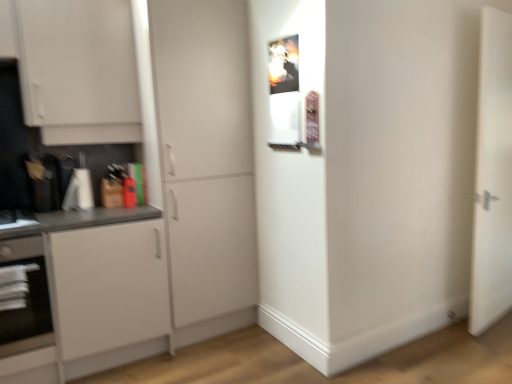
Question: Can you confirm if white matte door at right, which appears as the 2th door when viewed from the left, is smaller than white matte cabinet at center, arranged as the 2th door when viewed from the right?

Choices:
 (A) no
 (B) yes

Answer: (B)

Question: Is white matte door at right, which appears as the 2th door when viewed from the left, positioned with its back to white matte cabinet at center, marked as the 1th door in a left-to-right arrangement?

Choices:
 (A) yes
 (B) no

Answer: (B)

Question: Considering the relative sizes of white matte door at right, arranged as the first door when viewed from the right, and white matte cabinet at center, arranged as the 2th door when viewed from the right, in the image provided, is white matte door at right, arranged as the first door when viewed from the right, thinner than white matte cabinet at center, arranged as the 2th door when viewed from the right,?

Choices:
 (A) no
 (B) yes

Answer: (B)

Question: Considering the relative positions of white matte door at right, which appears as the 2th door when viewed from the left, and white matte cabinet at center, marked as the 1th door in a left-to-right arrangement, in the image provided, is white matte door at right, which appears as the 2th door when viewed from the left, in front of white matte cabinet at center, marked as the 1th door in a left-to-right arrangement,?

Choices:
 (A) no
 (B) yes

Answer: (A)

Question: From a real-world perspective, is white matte door at right, arranged as the first door when viewed from the right, under white matte cabinet at center, arranged as the 2th door when viewed from the right?

Choices:
 (A) no
 (B) yes

Answer: (B)

Question: Are white matte door at right, which appears as the 2th door when viewed from the left, and white matte cabinet at center, marked as the 1th door in a left-to-right arrangement, located far from each other?

Choices:
 (A) yes
 (B) no

Answer: (A)

Question: Is the position of white matte cabinet at center, arranged as the 2th door when viewed from the right, less distant than that of white matte door at right, which appears as the 2th door when viewed from the left?

Choices:
 (A) no
 (B) yes

Answer: (B)

Question: Does white matte cabinet at center, marked as the 1th door in a left-to-right arrangement, have a lesser height compared to white matte door at right, which appears as the 2th door when viewed from the left?

Choices:
 (A) yes
 (B) no

Answer: (B)

Question: From a real-world perspective, is white matte cabinet at center, marked as the 1th door in a left-to-right arrangement, on white matte door at right, which appears as the 2th door when viewed from the left?

Choices:
 (A) yes
 (B) no

Answer: (A)

Question: Is white matte cabinet at center, arranged as the 2th door when viewed from the right, looking in the opposite direction of white matte door at right, which appears as the 2th door when viewed from the left?

Choices:
 (A) yes
 (B) no

Answer: (B)

Question: From a real-world perspective, does white matte cabinet at center, arranged as the 2th door when viewed from the right, sit lower than white matte door at right, which appears as the 2th door when viewed from the left?

Choices:
 (A) no
 (B) yes

Answer: (A)

Question: Is white matte cabinet at center, arranged as the 2th door when viewed from the right, touching white matte door at right, arranged as the first door when viewed from the right?

Choices:
 (A) yes
 (B) no

Answer: (B)

Question: Considering the relative positions of black glass oven at lower left and white matte cabinet at center, marked as the 1th door in a left-to-right arrangement, in the image provided, is black glass oven at lower left to the left of white matte cabinet at center, marked as the 1th door in a left-to-right arrangement, from the viewer's perspective?

Choices:
 (A) yes
 (B) no

Answer: (A)